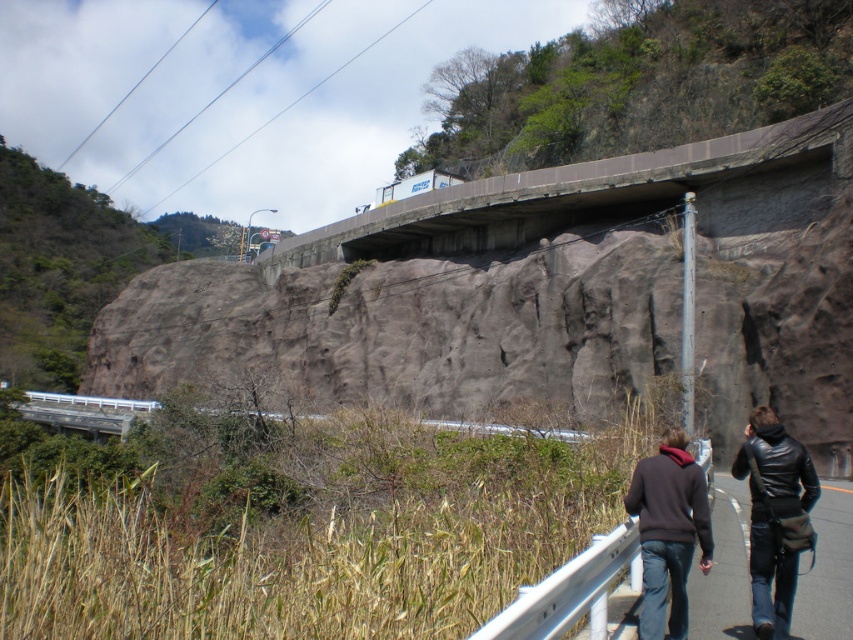
You are a hiker planning to cross the concrete bridge at upper center. You notice a dark brown leather jacket at lower right lying near the edge of the bridge. Given the bridge is wider than the jacket, can you safely walk across the bridge while avoiding the jacket?

The concrete bridge at upper center is wider than the dark brown leather jacket at lower right, so yes, you can safely walk across the bridge while avoiding the jacket.

You are standing at the guardrail on the road and see two points marked in the scene. Which point is closer to you, point (761, 157) or point (776, 557)?

Point (761, 157) is closer to you because it is further to the camera than point (776, 557).

You are a hiker standing at the base of the rocky hillside. You see the concrete bridge at upper center and the black leather jacket at lower right. Which object is located to the right of the other?

The concrete bridge at upper center is positioned on the right side of black leather jacket at lower right.